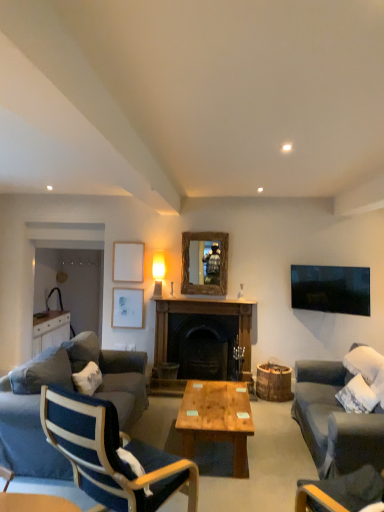
Question: Is point pyautogui.click(x=119, y=309) positioned closer to the camera than point pyautogui.click(x=342, y=374)?

Choices:
 (A) closer
 (B) farther

Answer: (B)

Question: Looking at their shapes, would you say white matte picture frame at upper center, marked as the 2th picture frame in a top-to-bottom arrangement, is wider or thinner than dark gray fabric couch at right, the 1th studio couch from the right?

Choices:
 (A) wide
 (B) thin

Answer: (B)

Question: Estimate the real-world distances between objects in this image. Which object is closer to the wooden/matte coffee table at center?

Choices:
 (A) white matte picture frame at upper center, marked as the 2th picture frame in a top-to-bottom arrangement
 (B) velvet dark blue armchair at lower right, positioned as the 2th chair in left-to-right order
 (C) blue fabric chair at left, which ranks as the first chair in left-to-right order
 (D) matte glass lampshade at upper center
 (E) white matte picture frame at upper center, the 1th picture frame in the top-to-bottom sequence

Answer: (C)

Question: Which object is the farthest from the velvet dark blue armchair at lower right, positioned as the 2th chair in left-to-right order?

Choices:
 (A) wooden/matte coffee table at center
 (B) matte glass lampshade at upper center
 (C) white matte picture frame at upper center, acting as the first picture frame starting from the bottom
 (D) dark wood fireplace at center
 (E) white cotton pillow at left

Answer: (C)